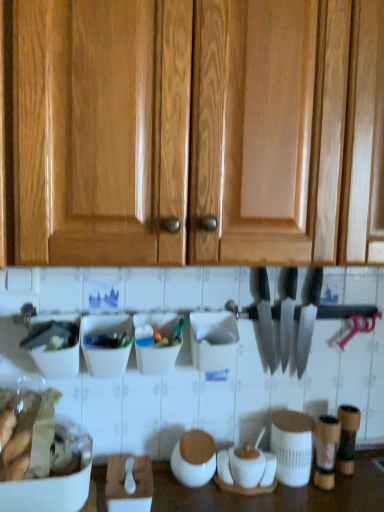
Identify the location of polished silver knife at center, which is counted as the 2th knife, starting from the left. The height and width of the screenshot is (512, 384). (288, 317).

The height and width of the screenshot is (512, 384). What do you see at coordinates (194, 458) in the screenshot?
I see `white matte jar at center, the 1th appliance viewed from the left` at bounding box center [194, 458].

In order to face glossy wood cabinets at upper center, should I rotate leftwards or rightwards?

You should look right and rotate roughly 7.001 degrees.

What do you see at coordinates (292, 446) in the screenshot? Image resolution: width=384 pixels, height=512 pixels. I see `white matte jar at center, the first appliance when ordered from right to left` at bounding box center [292, 446].

The image size is (384, 512). Describe the element at coordinates (266, 318) in the screenshot. I see `polished silver knife at center, the 2th knife in the right-to-left sequence` at that location.

Where is `polished silver knife at center, which is counted as the 2th knife, starting from the left`? This screenshot has width=384, height=512. polished silver knife at center, which is counted as the 2th knife, starting from the left is located at coordinates (288, 317).

Is white matte jar at center, the 2th appliance in the left-to-right sequence, to the left or to the right of glossy wood cabinets at upper center in the image?

From the image, it's evident that white matte jar at center, the 2th appliance in the left-to-right sequence, is to the right of glossy wood cabinets at upper center.

Which is more distant, (280, 476) or (141, 219)?

Point (280, 476)

Does white matte jar at center, the 2th appliance in the left-to-right sequence, have a lesser width compared to glossy wood cabinets at upper center?

Correct, the width of white matte jar at center, the 2th appliance in the left-to-right sequence, is less than that of glossy wood cabinets at upper center.

Between glossy wood cabinets at upper center and white matte jar at center, the 1th appliance viewed from the left, which one has less height?

white matte jar at center, the 1th appliance viewed from the left.

Is point (256, 117) farther from viewer compared to point (202, 450)?

No, (256, 117) is in front of (202, 450).

Consider the image. From a real-world perspective, relative to white matte jar at center, the 1th appliance viewed from the left, is glossy wood cabinets at upper center vertically above or below?

Clearly, from a real-world perspective, glossy wood cabinets at upper center is above white matte jar at center, the 1th appliance viewed from the left.

Based on the photo, how many degrees apart are the facing directions of polished silver knife at center, marked as the 1th knife in a right-to-left arrangement, and white matte jar at center, which is the second appliance in right-to-left order?

There is a 7.93-degree angle between the facing directions of polished silver knife at center, marked as the 1th knife in a right-to-left arrangement, and white matte jar at center, which is the second appliance in right-to-left order.

Is polished silver knife at center, marked as the 1th knife in a right-to-left arrangement, next to white matte jar at center, the 1th appliance viewed from the left, and touching it?

No, polished silver knife at center, marked as the 1th knife in a right-to-left arrangement, is not in contact with white matte jar at center, the 1th appliance viewed from the left.

Is polished silver knife at center, which is counted as the 2th knife, starting from the left, positioned beyond the bounds of white matte jar at center, which is the second appliance in right-to-left order?

Yes, polished silver knife at center, which is counted as the 2th knife, starting from the left, is outside of white matte jar at center, which is the second appliance in right-to-left order.

Is white matte jar at center, the first appliance when ordered from right to left, to the right of polished silver knife at center, marked as the 1th knife in a right-to-left arrangement, from the viewer's perspective?

Incorrect, white matte jar at center, the first appliance when ordered from right to left, is not on the right side of polished silver knife at center, marked as the 1th knife in a right-to-left arrangement.

Is polished silver knife at center, marked as the 1th knife in a right-to-left arrangement, surrounded by white matte jar at center, the first appliance when ordered from right to left?

Definitely not — polished silver knife at center, marked as the 1th knife in a right-to-left arrangement, is not inside white matte jar at center, the first appliance when ordered from right to left.

Looking at this image, from a real-world perspective, is white matte jar at center, the 2th appliance in the left-to-right sequence, above or below polished silver knife at center, which is counted as the 2th knife, starting from the left?

Clearly, from a real-world perspective, white matte jar at center, the 2th appliance in the left-to-right sequence, is below polished silver knife at center, which is counted as the 2th knife, starting from the left.

Is glossy wood cabinets at upper center at the back of polished silver knife at center, marked as the 1th knife in a right-to-left arrangement?

That's not correct — polished silver knife at center, marked as the 1th knife in a right-to-left arrangement, is not looking away from glossy wood cabinets at upper center.

At what (x,y) coordinates should I click in order to perform the action: click on cabinetry above the polished silver knife at center, marked as the 1th knife in a right-to-left arrangement (from a real-world perspective). Please return your answer as a coordinate pair (x, y). The height and width of the screenshot is (512, 384). Looking at the image, I should click on (198, 131).

Which object is further away from the camera, polished silver knife at center, marked as the 1th knife in a right-to-left arrangement, or glossy wood cabinets at upper center?

polished silver knife at center, marked as the 1th knife in a right-to-left arrangement, is behind.

Is glossy wood cabinets at upper center surrounded by polished silver knife at center, marked as the 1th knife in a right-to-left arrangement?

No, glossy wood cabinets at upper center is not surrounded by polished silver knife at center, marked as the 1th knife in a right-to-left arrangement.

Is polished silver knife at center, the 2th knife in the right-to-left sequence, far away from polished silver knife at center, marked as the 1th knife in a right-to-left arrangement?

polished silver knife at center, the 2th knife in the right-to-left sequence, is near polished silver knife at center, marked as the 1th knife in a right-to-left arrangement, not far away.

Which object is closer to the camera, polished silver knife at center, the 1th knife viewed from the left, or polished silver knife at center, which is counted as the 2th knife, starting from the left?

polished silver knife at center, the 1th knife viewed from the left, is in front.

Consider the image. Considering the relative sizes of polished silver knife at center, the 1th knife viewed from the left, and polished silver knife at center, which is counted as the 2th knife, starting from the left, in the image provided, is polished silver knife at center, the 1th knife viewed from the left, bigger than polished silver knife at center, which is counted as the 2th knife, starting from the left,?

Indeed, polished silver knife at center, the 1th knife viewed from the left, has a larger size compared to polished silver knife at center, which is counted as the 2th knife, starting from the left.

I want to click on cabinetry lying on the left of polished silver knife at center, the 2th knife in the right-to-left sequence, so click(198, 131).

Is glossy wood cabinets at upper center facing towards polished silver knife at center, the 2th knife in the right-to-left sequence?

No, glossy wood cabinets at upper center is not turned towards polished silver knife at center, the 2th knife in the right-to-left sequence.

Can you confirm if glossy wood cabinets at upper center is positioned to the left of polished silver knife at center, the 1th knife viewed from the left?

Correct, you'll find glossy wood cabinets at upper center to the left of polished silver knife at center, the 1th knife viewed from the left.

Between point (46, 201) and point (271, 365), which one is positioned behind?

Point (271, 365)

Locate an element on the screen. appliance on the right of glossy wood cabinets at upper center is located at coordinates (292, 446).

Where is `appliance that is the 2nd one below the glossy wood cabinets at upper center (from a real-world perspective)`? appliance that is the 2nd one below the glossy wood cabinets at upper center (from a real-world perspective) is located at coordinates (194, 458).

Considering their positions, is polished silver knife at center, the 2th knife in the right-to-left sequence, positioned further to polished silver knife at center, which is counted as the 2th knife, starting from the left, than white matte jar at center, the first appliance when ordered from right to left?

white matte jar at center, the first appliance when ordered from right to left.

Based on their spatial positions, is polished silver knife at center, the 2th knife in the right-to-left sequence, or white matte jar at center, the 1th appliance viewed from the left, closer to white matte jar at center, the 2th appliance in the left-to-right sequence?

white matte jar at center, the 1th appliance viewed from the left.

From the picture: Which object lies further to the anchor point white matte jar at center, which is the second appliance in right-to-left order, white matte jar at center, the 2th appliance in the left-to-right sequence, or polished silver knife at center, the 1th knife viewed from the left?

polished silver knife at center, the 1th knife viewed from the left.

When comparing their distances from polished silver knife at center, the 1th knife viewed from the left, does white matte jar at center, the 1th appliance viewed from the left, or polished silver knife at center, marked as the 1th knife in a right-to-left arrangement, seem closer?

polished silver knife at center, marked as the 1th knife in a right-to-left arrangement.

From the image, which object appears to be nearer to polished silver knife at center, marked as the 1th knife in a right-to-left arrangement, white matte jar at center, the 1th appliance viewed from the left, or polished silver knife at center, the 1th knife viewed from the left?

polished silver knife at center, the 1th knife viewed from the left, is closer to polished silver knife at center, marked as the 1th knife in a right-to-left arrangement.

When comparing their distances from polished silver knife at center, marked as the 1th knife in a right-to-left arrangement, does white matte jar at center, the first appliance when ordered from right to left, or polished silver knife at center, the 2th knife in the right-to-left sequence, seem closer?

polished silver knife at center, the 2th knife in the right-to-left sequence, lies closer to polished silver knife at center, marked as the 1th knife in a right-to-left arrangement, than the other object.

Estimate the real-world distances between objects in this image. Which object is further from glossy wood cabinets at upper center, white matte jar at center, the first appliance when ordered from right to left, or white matte jar at center, the 1th appliance viewed from the left?

The object further to glossy wood cabinets at upper center is white matte jar at center, the first appliance when ordered from right to left.

Looking at the image, which one is located closer to glossy wood cabinets at upper center, white matte jar at center, which is the second appliance in right-to-left order, or polished silver knife at center, the 2th knife in the right-to-left sequence?

polished silver knife at center, the 2th knife in the right-to-left sequence, lies closer to glossy wood cabinets at upper center than the other object.

The width and height of the screenshot is (384, 512). I want to click on appliance between polished silver knife at center, the 2th knife in the right-to-left sequence, and white matte jar at center, which is the second appliance in right-to-left order, in the up-down direction, so click(x=292, y=446).

You are a GUI agent. You are given a task and a screenshot of the screen. Output one action in this format:
    pyautogui.click(x=<x>, y=<y>)
    Task: Click on the knife between polished silver knife at center, the 2th knife in the right-to-left sequence, and white matte jar at center, which is the second appliance in right-to-left order, from top to bottom
    The width and height of the screenshot is (384, 512).
    Given the screenshot: What is the action you would take?
    pyautogui.click(x=288, y=317)

The height and width of the screenshot is (512, 384). What are the coordinates of `knife between glossy wood cabinets at upper center and polished silver knife at center, marked as the 1th knife in a right-to-left arrangement, along the z-axis` in the screenshot? It's located at (266, 318).

Identify the location of appliance between polished silver knife at center, marked as the 1th knife in a right-to-left arrangement, and white matte jar at center, the 1th appliance viewed from the left, vertically. Image resolution: width=384 pixels, height=512 pixels. (292, 446).